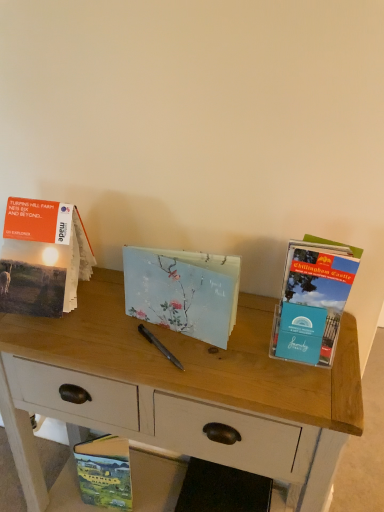
This screenshot has width=384, height=512. What are the coordinates of `free space above wooden desk at center (from a real-world perspective)` in the screenshot? It's located at (163, 328).